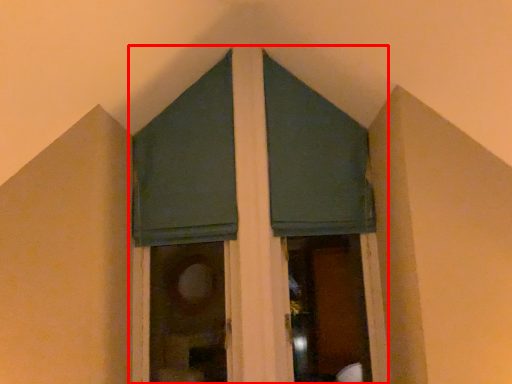
Question: From the image's perspective, what is the correct spatial relationship of bay window (annotated by the red box) in relation to window screen?

Choices:
 (A) above
 (B) below

Answer: (B)